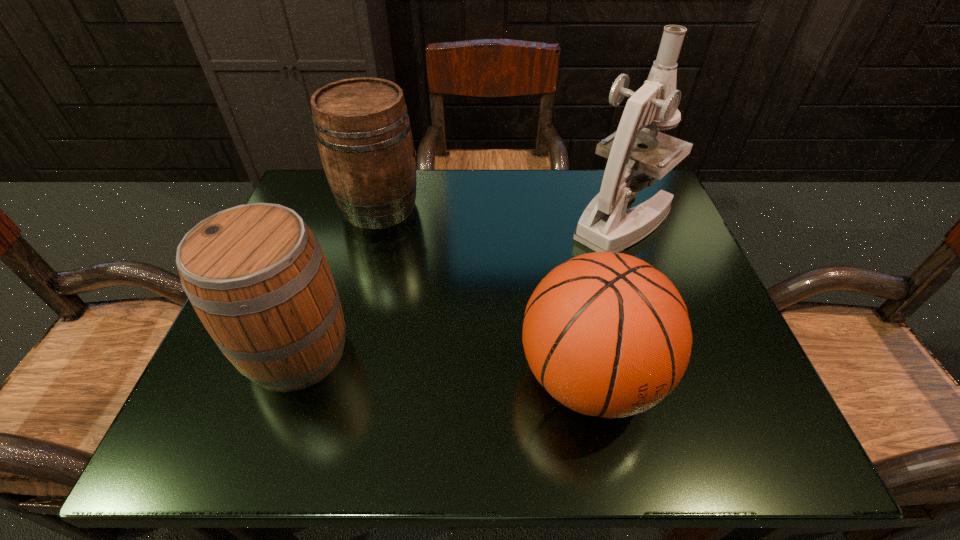
The width and height of the screenshot is (960, 540). What are the coordinates of `free location that satisfies the following two spatial constraints: 1. on the side of the farther cider near the bung hole; 2. on the back side of the basketball` in the screenshot? It's located at 335,377.